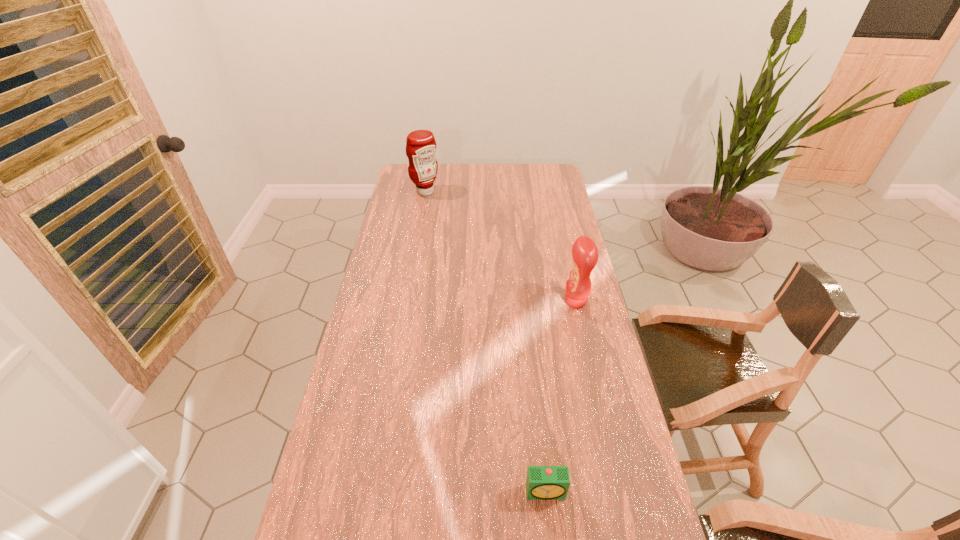
In order to click on the left condiment in this screenshot , I will do `click(421, 147)`.

The image size is (960, 540). I want to click on the leftmost object, so click(421, 147).

The width and height of the screenshot is (960, 540). In order to click on the right condiment in this screenshot , I will do `click(584, 251)`.

Where is `the nearer condiment`? Image resolution: width=960 pixels, height=540 pixels. the nearer condiment is located at coordinates (584, 251).

This screenshot has height=540, width=960. I want to click on the second object from left to right, so click(x=543, y=482).

Identify the location of alarm clock. coord(543,482).

You are a GUI agent. You are given a task and a screenshot of the screen. Output one action in this format:
    pyautogui.click(x=<x>, y=<y>)
    Task: Click on the vacant region located on the front of the leftmost object
    
    Given the screenshot: What is the action you would take?
    pyautogui.click(x=418, y=233)

The height and width of the screenshot is (540, 960). I want to click on free spot located 0.110m on the label side of the nearer condiment, so click(533, 301).

Identify the location of blank space located on the label side of the nearer condiment. pos(547,301).

Locate an element on the screen. Image resolution: width=960 pixels, height=540 pixels. free point located on the label side of the nearer condiment is located at coordinates (539, 301).